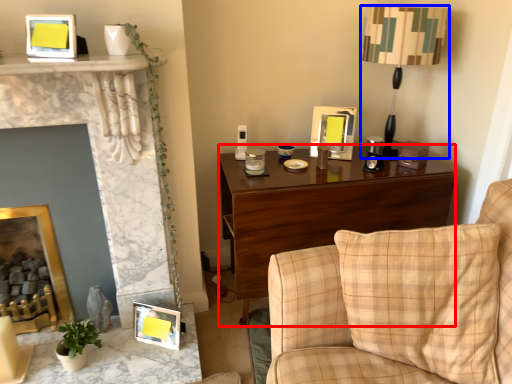
Question: Which object appears closest to the camera in this image, desk (highlighted by a red box) or table lamp (highlighted by a blue box)?

Choices:
 (A) desk
 (B) table lamp

Answer: (B)